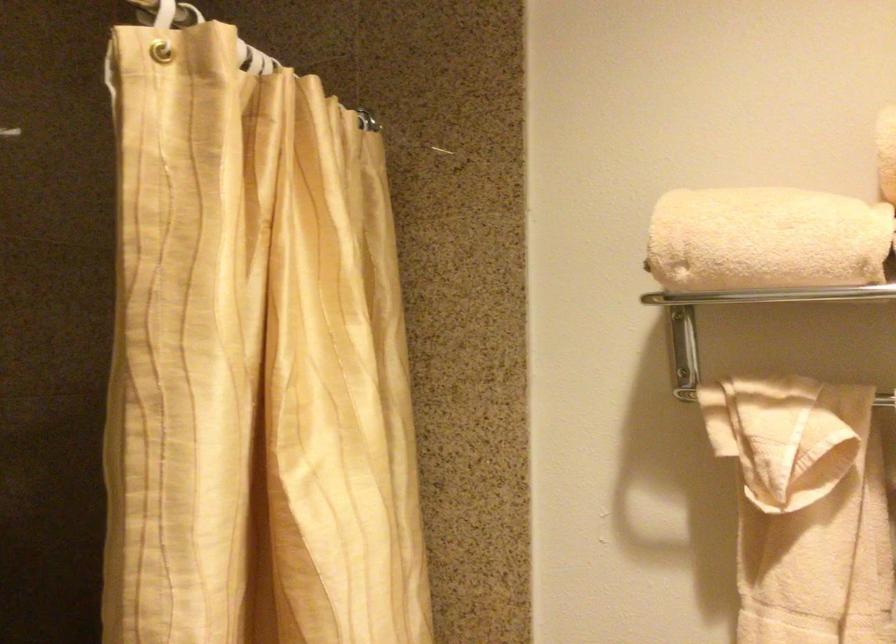
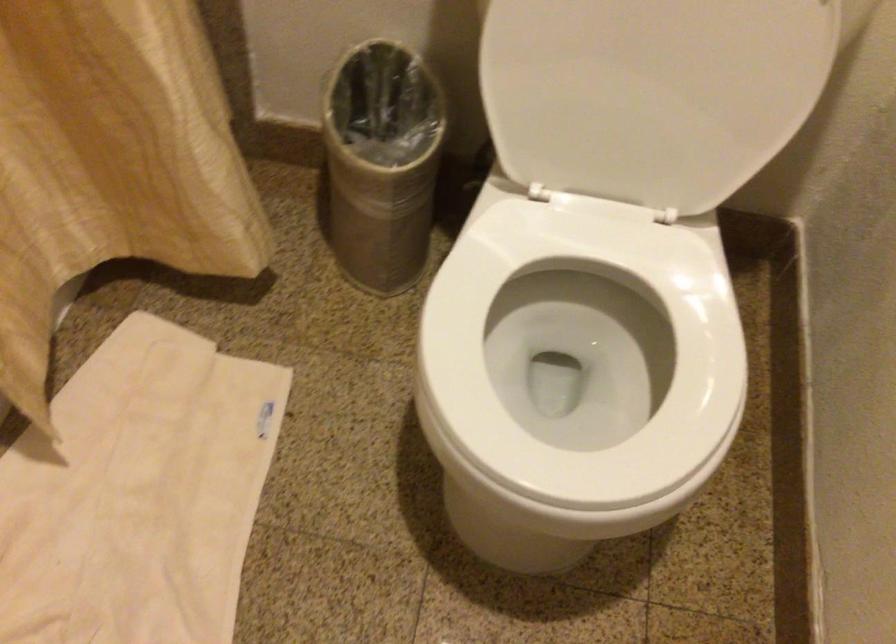
How did the camera likely rotate?

The camera's rotation is toward right-down.